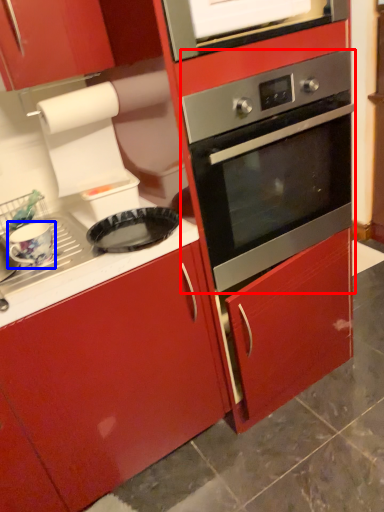
Question: Among these objects, which one is nearest to the camera, oven (highlighted by a red box) or appliance (highlighted by a blue box)?

Choices:
 (A) oven
 (B) appliance

Answer: (A)